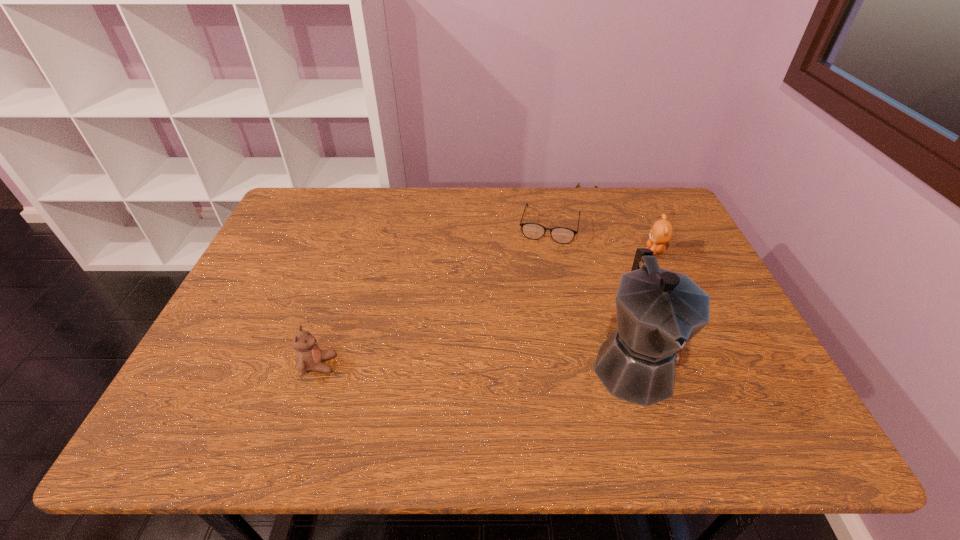
Where is `free space between the shortest object and the rightmost object`? free space between the shortest object and the rightmost object is located at coordinates (603, 238).

Identify the location of vacant region between the spectacles and the rightmost object. This screenshot has height=540, width=960. (603, 238).

Identify which object is the second nearest to the shortest object. Please provide its 2D coordinates. Your answer should be formatted as a tuple, i.e. [(x, y)], where the tuple contains the x and y coordinates of a point satisfying the conditions above.

[(659, 311)]

In order to click on the closest object relative to the left teddy bear in this screenshot , I will do `click(659, 311)`.